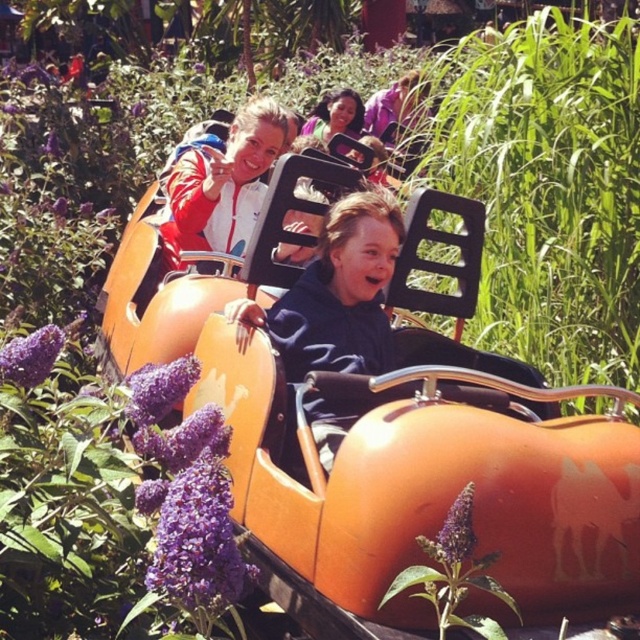
You are standing in the theme park and want to take a photo of both the point at coordinates point (256,214) and point (353,93). Which point will appear larger in your photo?

Point (256,214) is closer to the camera than point (353,93), so it will appear larger in the photo.

You are a photographer at the theme park and want to capture a photo of both the matte red jacket at upper center and the smooth skin girl at center in the same frame. Which object should you focus on first to ensure both are in the frame?

You should focus on the smooth skin girl at center first because the matte red jacket at upper center is smaller than the smooth skin girl at center, so adjusting the frame to include the larger object ensures the smaller one is also captured.